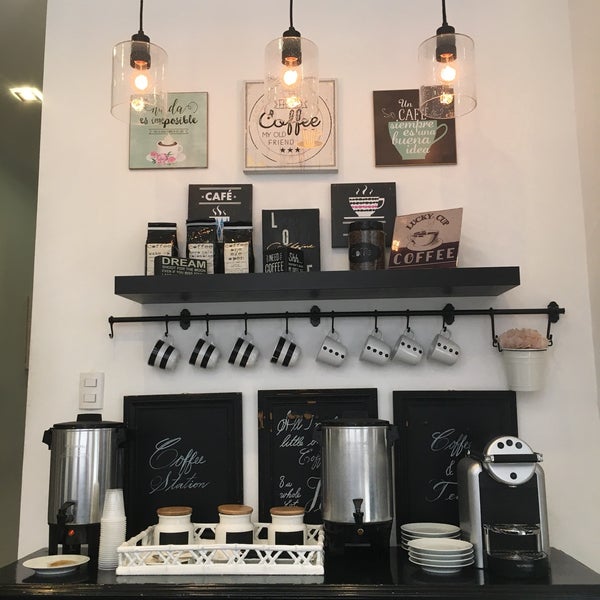
Where is `white ceramic plate`? This screenshot has height=600, width=600. white ceramic plate is located at coordinates (38, 568).